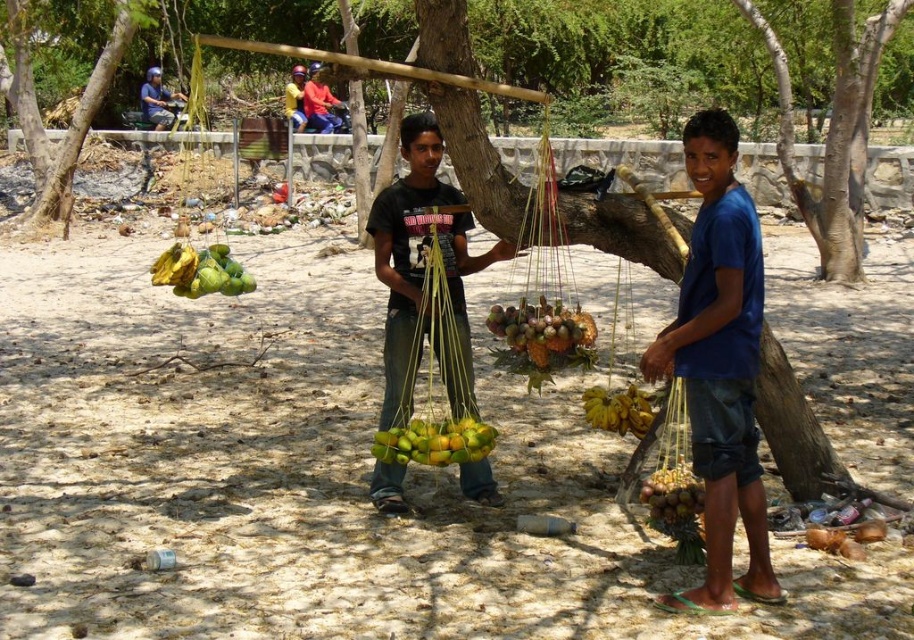
You are a photographer standing at the camera position. You want to take a photo of the scene so that the brown rough tree trunk at center is clearly visible in the foreground. Given that your camera has a depth of field that can focus on objects within 4 meters, will the tree trunk be in focus?

The brown rough tree trunk at center is 4.14 meters away from camera. Since the depth of field can focus up to 4 meters, the tree trunk is slightly beyond the focus range, so it will not be in focus.

You are a customer wanting to buy bananas. You see the matte black shirt at center and the yellow matte bananas at center. Which one is taller?

The matte black shirt at center is taller than the yellow matte bananas at center.

You are a customer trying to decide which vendor to approach. The vendor with the wider torso might have a larger selection. Based on the image, which vendor has a wider torso between the matte black shirt at center and the yellow matte bananas at center?

The matte black shirt at center has a larger width than the yellow matte bananas at center, so the vendor wearing the matte black shirt at center has a wider torso and likely a larger selection.